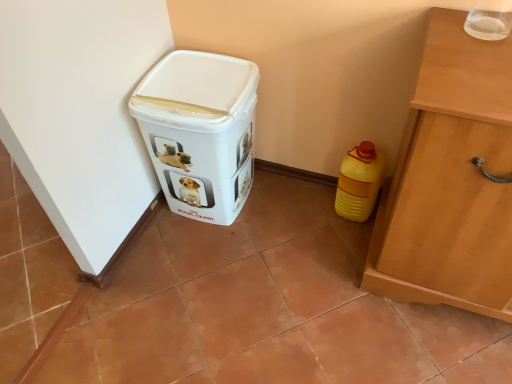
Question: In terms of width, does white plastic container at lower left look wider or thinner when compared to yellow plastic bottle at lower right?

Choices:
 (A) thin
 (B) wide

Answer: (B)

Question: Is white plastic container at lower left to the left or to the right of yellow plastic bottle at lower right in the image?

Choices:
 (A) left
 (B) right

Answer: (A)

Question: From the image's perspective, is white plastic container at lower left above or below yellow plastic bottle at lower right?

Choices:
 (A) above
 (B) below

Answer: (A)

Question: Which is correct: yellow plastic bottle at lower right is inside white plastic container at lower left, or outside of it?

Choices:
 (A) outside
 (B) inside

Answer: (A)

Question: From a real-world perspective, relative to white plastic container at lower left, is yellow plastic bottle at lower right vertically above or below?

Choices:
 (A) above
 (B) below

Answer: (B)

Question: Considering the positions of yellow plastic bottle at lower right and white plastic container at lower left in the image, is yellow plastic bottle at lower right bigger or smaller than white plastic container at lower left?

Choices:
 (A) small
 (B) big

Answer: (A)

Question: Is yellow plastic bottle at lower right to the left or to the right of white plastic container at lower left in the image?

Choices:
 (A) right
 (B) left

Answer: (A)